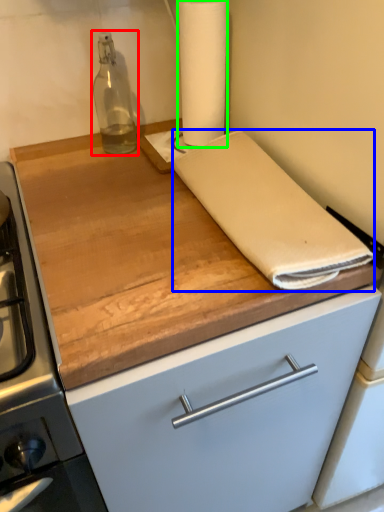
Question: Which object is the farthest from bottle (highlighted by a red box)? Choose among these: linen (highlighted by a blue box) or paper towel (highlighted by a green box).

Choices:
 (A) linen
 (B) paper towel

Answer: (A)